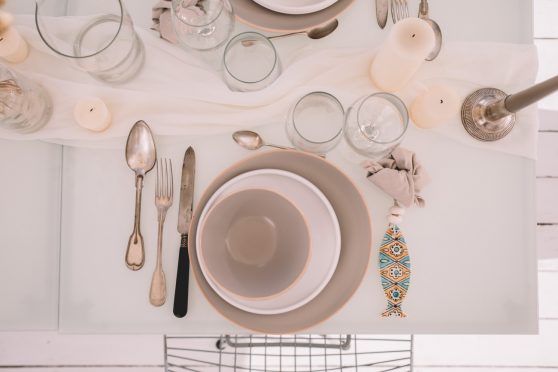
Image resolution: width=558 pixels, height=372 pixels. In order to click on spoons in this screenshot , I will do [x=134, y=147], [x=250, y=135], [x=329, y=27], [x=436, y=36].